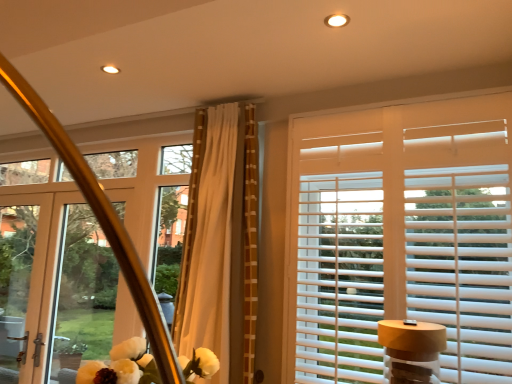
Question: Is matte white door at left not near beige textured curtain at center?

Choices:
 (A) yes
 (B) no

Answer: (A)

Question: Is matte white door at left positioned behind beige textured curtain at center?

Choices:
 (A) yes
 (B) no

Answer: (A)

Question: Is matte white door at left next to beige textured curtain at center?

Choices:
 (A) yes
 (B) no

Answer: (B)

Question: Considering the relative positions of matte white door at left and beige textured curtain at center in the image provided, is matte white door at left to the right of beige textured curtain at center from the viewer's perspective?

Choices:
 (A) no
 (B) yes

Answer: (A)

Question: Is matte white door at left closer to the viewer compared to beige textured curtain at center?

Choices:
 (A) yes
 (B) no

Answer: (B)

Question: From a real-world perspective, is matte white door at left over beige textured curtain at center?

Choices:
 (A) no
 (B) yes

Answer: (A)

Question: Can you confirm if clear glass screen door at left is smaller than white wood blinds at upper right?

Choices:
 (A) no
 (B) yes

Answer: (B)

Question: Is clear glass screen door at left surrounding white wood blinds at upper right?

Choices:
 (A) no
 (B) yes

Answer: (A)

Question: Can you confirm if clear glass screen door at left is wider than white wood blinds at upper right?

Choices:
 (A) no
 (B) yes

Answer: (A)

Question: Is clear glass screen door at left to the left of white wood blinds at upper right from the viewer's perspective?

Choices:
 (A) yes
 (B) no

Answer: (A)

Question: Does clear glass screen door at left have a lesser width compared to white wood blinds at upper right?

Choices:
 (A) yes
 (B) no

Answer: (A)

Question: Is clear glass screen door at left far away from white wood blinds at upper right?

Choices:
 (A) yes
 (B) no

Answer: (A)

Question: Is beige textured curtain at center located within white wood blinds at upper right?

Choices:
 (A) yes
 (B) no

Answer: (B)